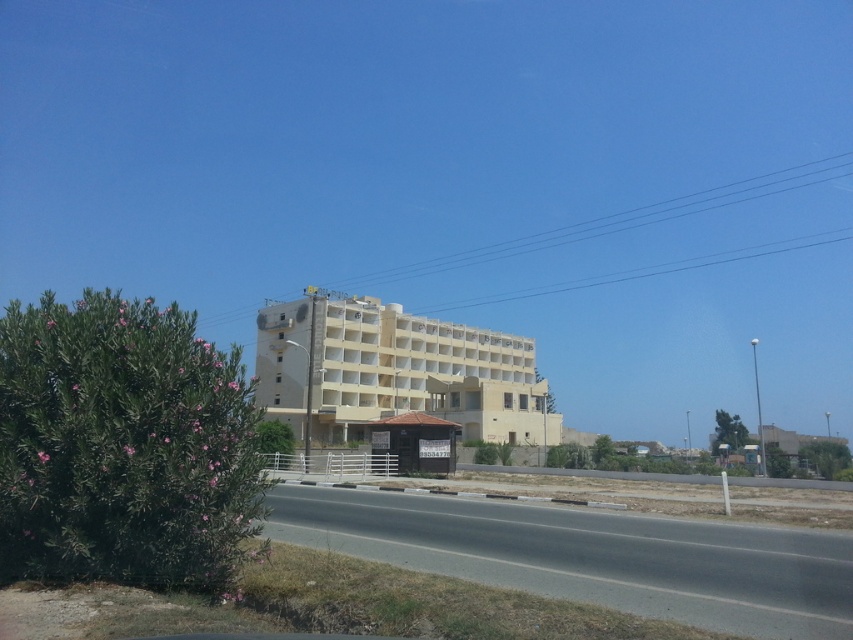
In the scene shown: You are a city planner analyzing the layout of this area. Based on the scene, which object occupies more space in the image, the asphalt road at center or the beige concrete building at center?

The beige concrete building at center occupies more space in the image than the asphalt road at center, as the asphalt road at center has a smaller size compared to beige concrete building at center.

From the picture: You are a city planner assessing the layout of this area. Given the asphalt road at center and the beige concrete building at center, which one has a smaller width?

The asphalt road at center has a smaller width than the beige concrete building at center according to the description.

You are standing at the point where the road meets the bush with pink flowers. You want to walk to the point marked as point (x=721, y=572). How far will you have to walk?

The point (x=721, y=572) is 9.34 meters away from the viewer, so you will have to walk 9.34 meters to reach it.